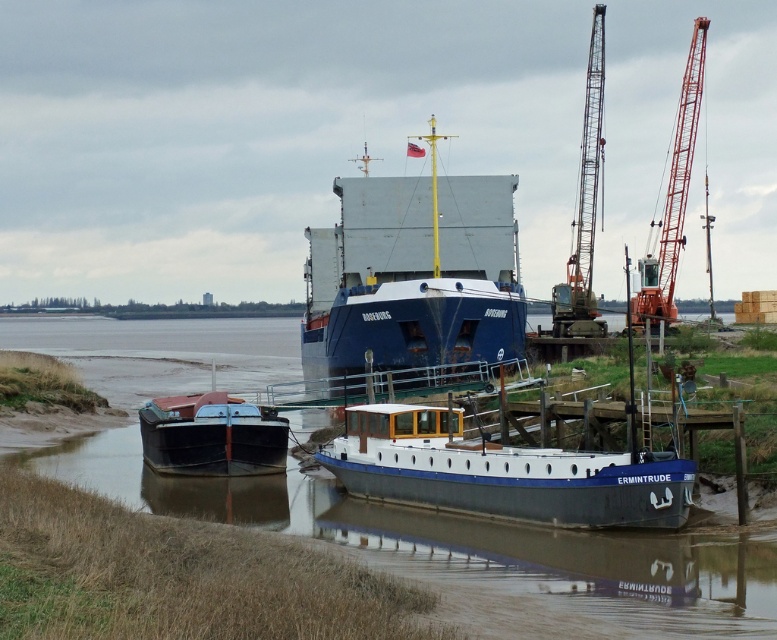
You are standing at point (629, 554) and want to walk to the boat named ERMINTRUDE. The path between you and ERMINTRUDE is 23.99 meters long. If your walking speed is 1.5 meters per second, how many seconds will it take you to reach ERMINTRUDE?

The distance between you and ERMINTRUDE is 23.99 meters. At a speed of 1.5 meters per second, the time required is 23.99 divided by 1.95, which equals approximately 15.54 seconds. Therefore, it will take about 15.54 seconds to reach ERMINTRUDE.

Based on the photo, you are standing on the dock and want to board the blue matte cargo ship at center. The safety regulations state that you must stay at least 50 meters away from any vessel undergoing maintenance. Are you compliant with the safety regulations?

The blue matte cargo ship at center is 44.70 meters away from viewer, which is less than the required 50 meters. Therefore, you are not compliant with the safety regulations.

You are standing on the dock and see the smooth mud at boat center and the orange metallic crane at upper right. Which object is closer to you?

The smooth mud at boat center is closer to you because it is in front of the orange metallic crane at upper right.